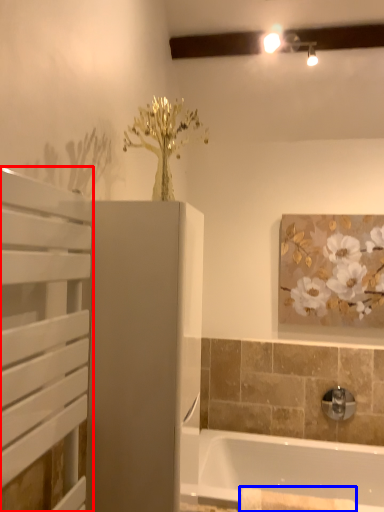
Question: Which object appears closest to the camera in this image, screen door (highlighted by a red box) or bath towel (highlighted by a blue box)?

Choices:
 (A) screen door
 (B) bath towel

Answer: (A)